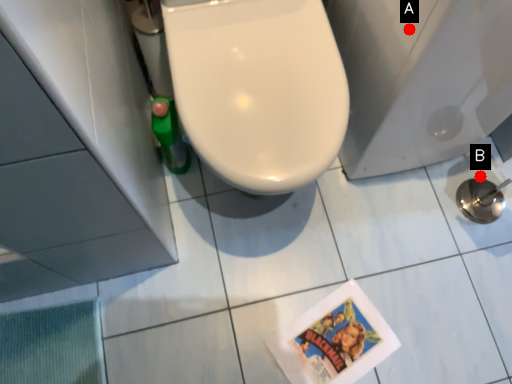
Question: Two points are circled on the image, labeled by A and B beside each circle. Which point is farther from the camera taking this photo?

Choices:
 (A) A is further
 (B) B is further

Answer: (B)